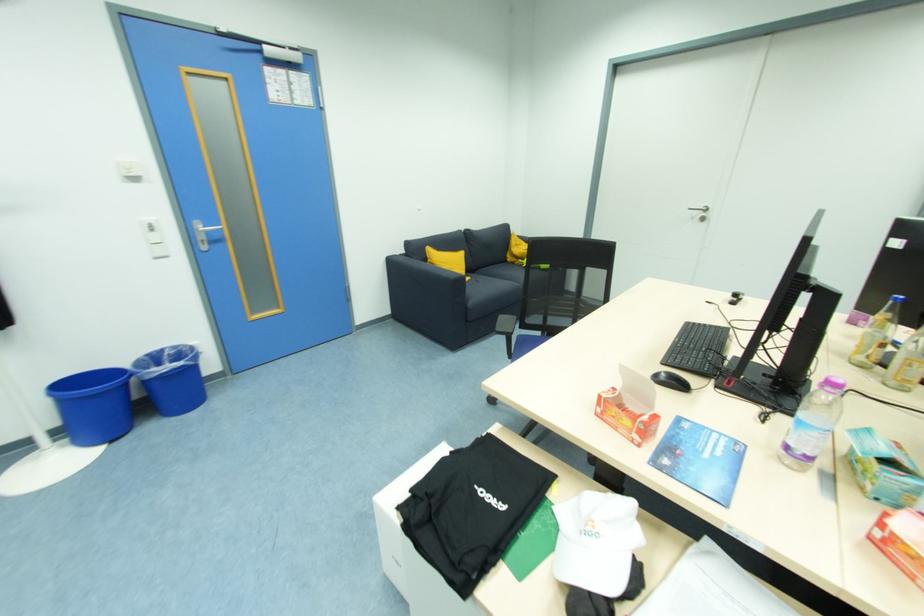
The height and width of the screenshot is (616, 924). Find the location of `sofa seat`. sofa seat is located at coordinates (511, 273).